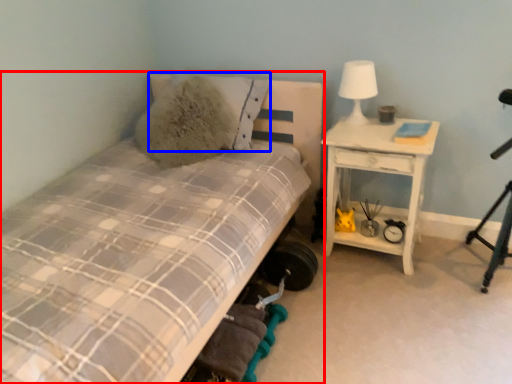
Question: Which point is closer to the camera, bed (highlighted by a red box) or pillow (highlighted by a blue box)?

Choices:
 (A) bed
 (B) pillow

Answer: (A)